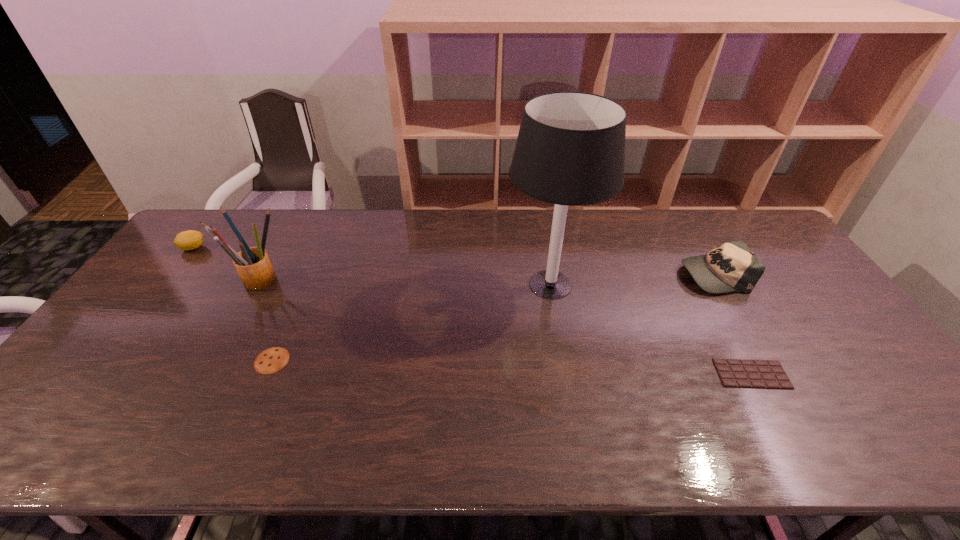
This screenshot has height=540, width=960. Identify the location of the tallest object. (570, 151).

Locate an element on the screen. The width and height of the screenshot is (960, 540). the third object from right to left is located at coordinates (570, 151).

You are a GUI agent. You are given a task and a screenshot of the screen. Output one action in this format:
    pyautogui.click(x=<x>, y=<y>)
    Task: Click on the second object from left to right
    This screenshot has height=540, width=960.
    Given the screenshot: What is the action you would take?
    pyautogui.click(x=253, y=265)

Locate an element on the screen. This screenshot has height=540, width=960. pencil box is located at coordinates (253, 265).

This screenshot has height=540, width=960. Identify the location of the third tallest object. (732, 266).

Locate an element on the screen. Image resolution: width=960 pixels, height=540 pixels. lemon is located at coordinates (188, 240).

In order to click on the third shortest object in this screenshot , I will do `click(188, 240)`.

Identify the location of the fifth tallest object. click(271, 360).

You are a GUI agent. You are given a task and a screenshot of the screen. Output one action in this format:
    pyautogui.click(x=<x>, y=<y>)
    Task: Click on the cookie
    The height and width of the screenshot is (540, 960).
    Given the screenshot: What is the action you would take?
    pyautogui.click(x=271, y=360)

Locate an element on the screen. chocolate bar is located at coordinates (741, 373).